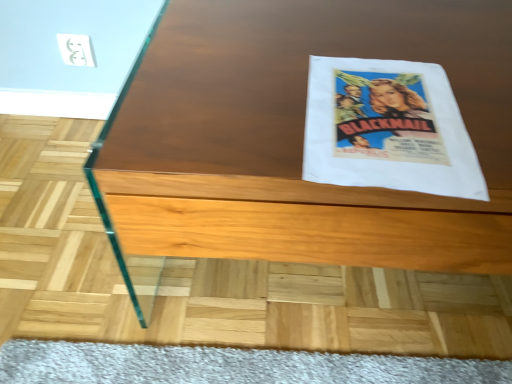
Question: From the image's perspective, is white paper flyer at upper right above or below wooden table at center?

Choices:
 (A) below
 (B) above

Answer: (B)

Question: Which is correct: white paper flyer at upper right is inside wooden table at center, or outside of it?

Choices:
 (A) outside
 (B) inside

Answer: (B)

Question: In terms of height, does white paper flyer at upper right look taller or shorter compared to wooden table at center?

Choices:
 (A) tall
 (B) short

Answer: (B)

Question: From the image's perspective, is wooden table at center above or below white paper flyer at upper right?

Choices:
 (A) below
 (B) above

Answer: (A)

Question: Choose the correct answer: Is wooden table at center inside white paper flyer at upper right or outside it?

Choices:
 (A) outside
 (B) inside

Answer: (A)

Question: Relative to white paper flyer at upper right, is wooden table at center in front or behind?

Choices:
 (A) front
 (B) behind

Answer: (A)

Question: Is wooden table at center bigger or smaller than white paper flyer at upper right?

Choices:
 (A) big
 (B) small

Answer: (A)